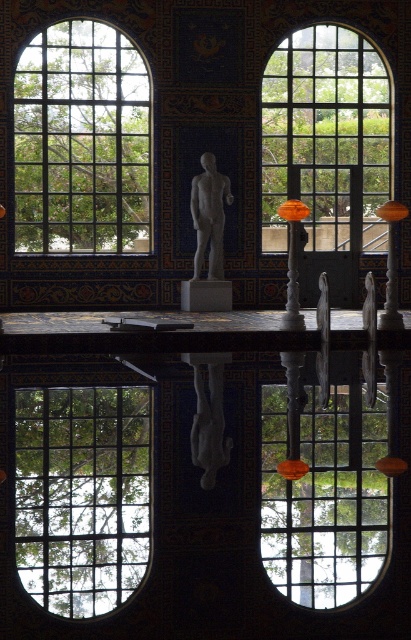
Question: Does clear glass window at upper left lie behind white marble pillar at center?

Choices:
 (A) yes
 (B) no

Answer: (A)

Question: Can you confirm if clear glass window at upper left is thinner than clear glass window at lower center?

Choices:
 (A) no
 (B) yes

Answer: (A)

Question: Which object is the closest to the white marble pillar at center?

Choices:
 (A) clear glass window at center
 (B) polished wood pillar at center
 (C) orange glass pillar at right
 (D) clear glass window at lower center

Answer: (B)

Question: Is clear glass window at lower center smaller than white marble pillar at center?

Choices:
 (A) no
 (B) yes

Answer: (B)

Question: Which of these objects is positioned farthest from the clear glass window at upper center?

Choices:
 (A) clear glass window at center
 (B) clear glass window at upper left

Answer: (A)

Question: Which is nearer to the gray marble statue at center?

Choices:
 (A) white marble pillar at center
 (B) clear glass window at upper center
 (C) clear glass window at center
 (D) polished wood pillar at center

Answer: (A)